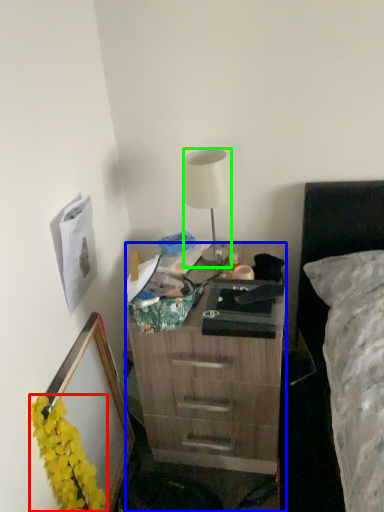
Question: Estimate the real-world distances between objects in this image. Which object is closer to flower (highlighted by a red box), desk (highlighted by a blue box) or lamp (highlighted by a green box)?

Choices:
 (A) desk
 (B) lamp

Answer: (A)